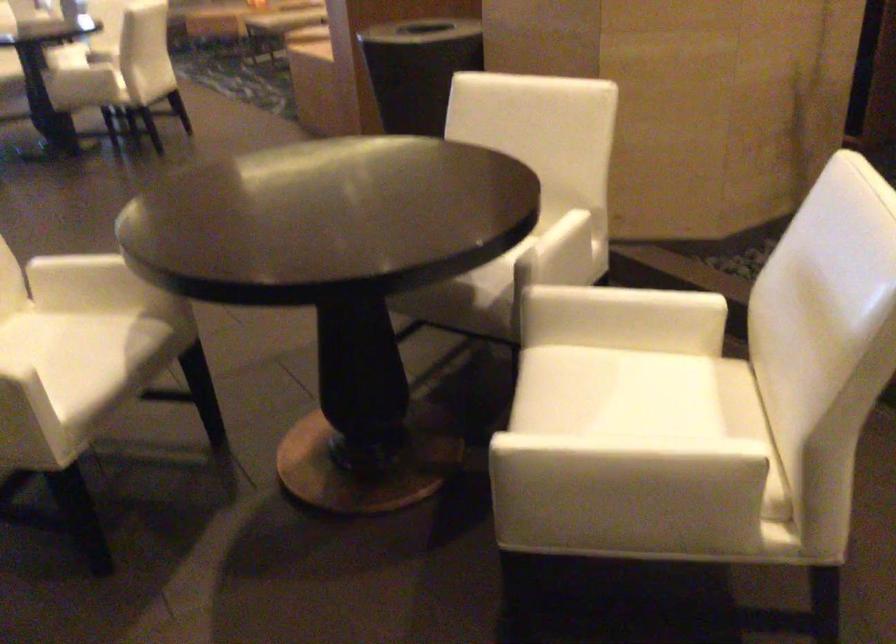
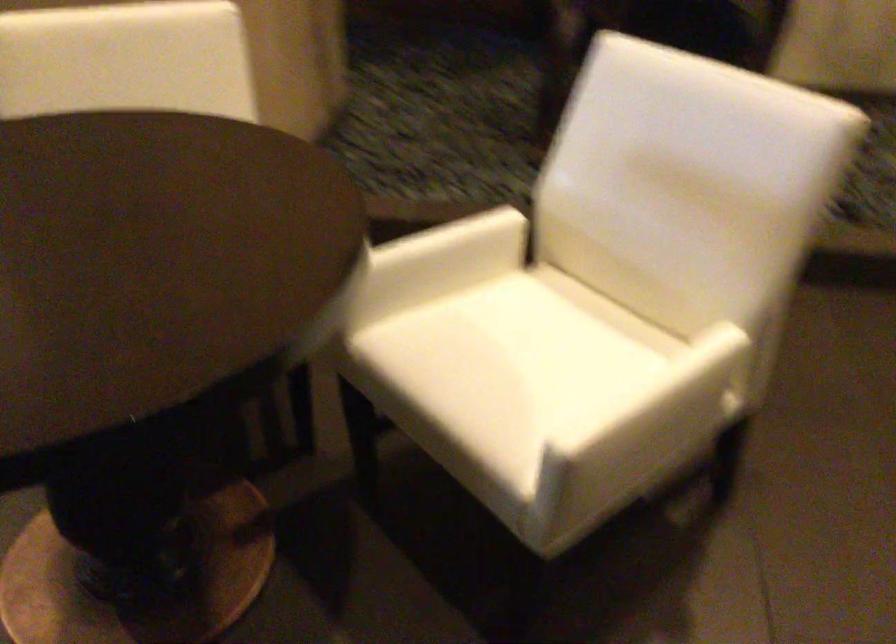
Where in the second image is the point corresponding to the point at 647,475 from the first image?

(684, 402)